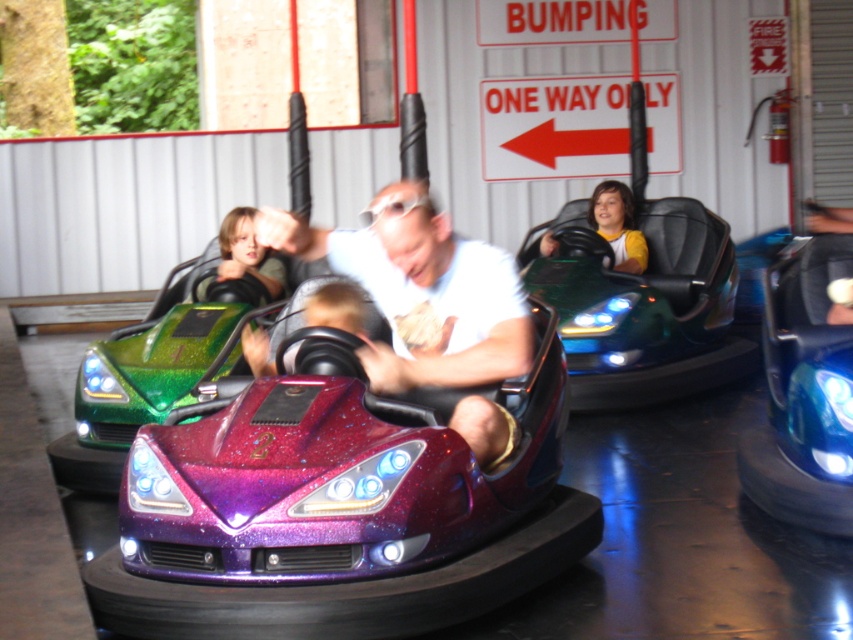
Can you confirm if shiny metallic car at center is positioned to the left of smooth skin child at center?

No, shiny metallic car at center is not to the left of smooth skin child at center.

I want to click on shiny metallic car at center, so click(421, 291).

Who is positioned more to the left, smooth skin child at center or yellow cotton shirt at center?

smooth skin child at center

Where is `smooth skin child at center`? The image size is (853, 640). smooth skin child at center is located at coordinates (247, 253).

Locate an element on the screen. This screenshot has height=640, width=853. smooth skin child at center is located at coordinates (247, 253).

Image resolution: width=853 pixels, height=640 pixels. What do you see at coordinates (421, 291) in the screenshot?
I see `shiny metallic car at center` at bounding box center [421, 291].

Is point (393, 296) behind point (637, 256)?

No, it is not.

Is point (409, 262) positioned in front of point (630, 230)?

Yes, point (409, 262) is in front of point (630, 230).

Where is `shiny metallic car at center`? Image resolution: width=853 pixels, height=640 pixels. shiny metallic car at center is located at coordinates (421, 291).